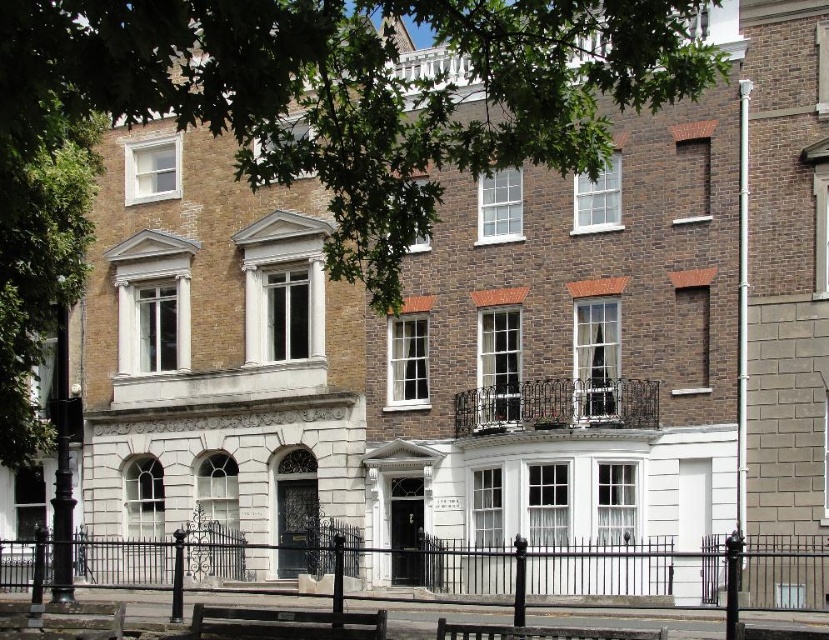
You are a tourist visiting this historic building and want to take a photo of both the black wrought iron fence at lower center and the wooden park bench at center. Since you want both objects in the frame, which object should you move closer to?

The black wrought iron fence at lower center is larger in size than the wooden park bench at center. To include both in the photo frame, you should move closer to the black wrought iron fence at lower center so that its larger size can be accommodated while still fitting the smaller wooden park bench at center into the shot.

You are a visitor standing in front of the historic building and want to take a photo that includes both the green leafy tree at upper center and the black wrought iron fence at lower center. Which object will appear larger in the photo?

The green leafy tree at upper center will appear larger in the photo because it is much taller than the black wrought iron fence at lower center.

You are standing at the entrance of the historic building and want to know the exact location of the black wrought iron fence at lower center. According to the coordinates provided, where is it positioned?

The black wrought iron fence at lower center is positioned at coordinates point (623, 568).